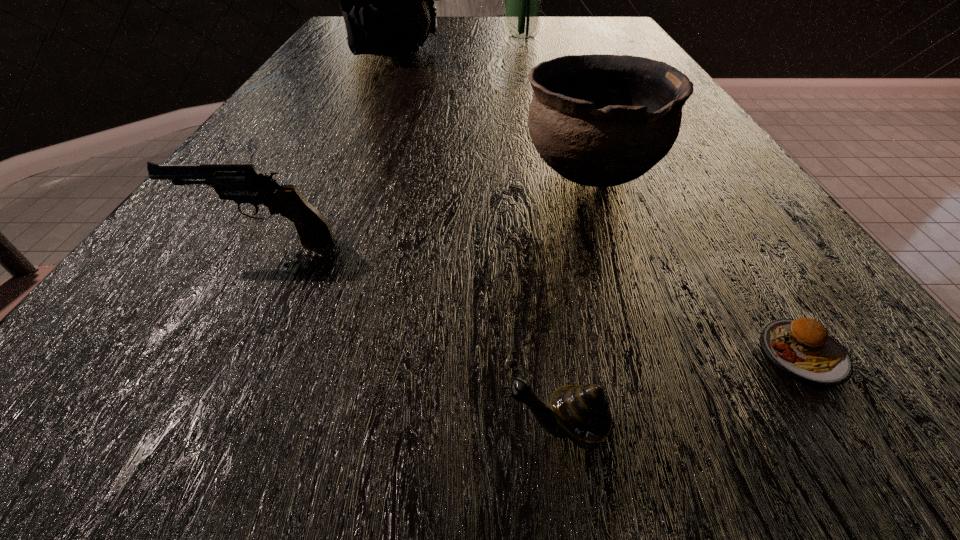
The width and height of the screenshot is (960, 540). Identify the location of free location at the right edge. (750, 343).

I want to click on vacant region at the far left corner of the desktop, so click(x=341, y=31).

Where is `free space at the near left corner of the desktop`? The image size is (960, 540). free space at the near left corner of the desktop is located at coordinates (70, 511).

This screenshot has width=960, height=540. I want to click on vacant space at the far right corner, so click(x=594, y=32).

This screenshot has height=540, width=960. What are the coordinates of `vacant space at the near right corner` in the screenshot? It's located at (946, 470).

At what (x,y) coordinates should I click in order to perform the action: click on free space between the shoulder bag and the patty. Please return your answer as a coordinate pair (x, y). Image resolution: width=960 pixels, height=540 pixels. Looking at the image, I should click on (598, 201).

Find the location of a particular element. unoccupied area between the fourth tallest object and the third farthest object is located at coordinates click(427, 207).

You are a GUI agent. You are given a task and a screenshot of the screen. Output one action in this format:
    pyautogui.click(x=<x>, y=<y>)
    Task: Click on the vacant region between the shoulder bag and the bouquet
    The height and width of the screenshot is (540, 960).
    Given the screenshot: What is the action you would take?
    pyautogui.click(x=458, y=44)

Where is `free spot between the patty and the bouquet`? free spot between the patty and the bouquet is located at coordinates (662, 195).

Where is `free spot between the fourth tallest object and the nearest object`? The image size is (960, 540). free spot between the fourth tallest object and the nearest object is located at coordinates (411, 336).